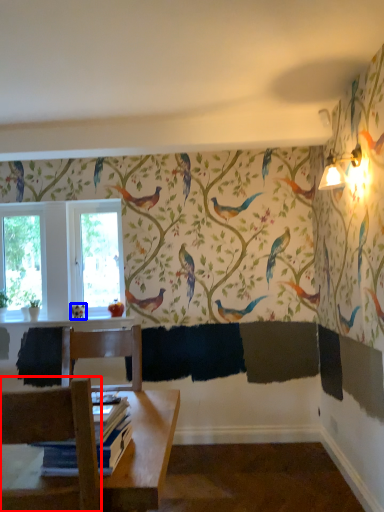
Question: Which object appears closest to the camera in this image, chair (highlighted by a red box) or bird (highlighted by a blue box)?

Choices:
 (A) chair
 (B) bird

Answer: (A)